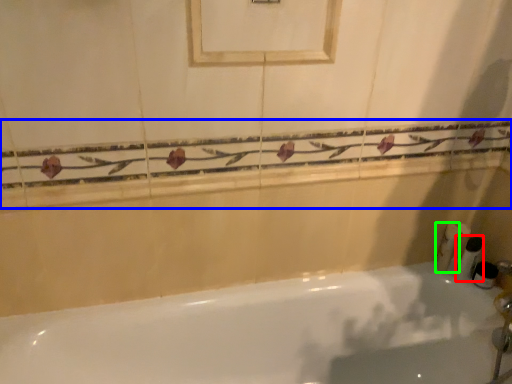
Question: Considering the real-world distances, which object is closest to toiletry (highlighted by a red box)? balustrade (highlighted by a blue box) or toiletry (highlighted by a green box).

Choices:
 (A) balustrade
 (B) toiletry

Answer: (B)